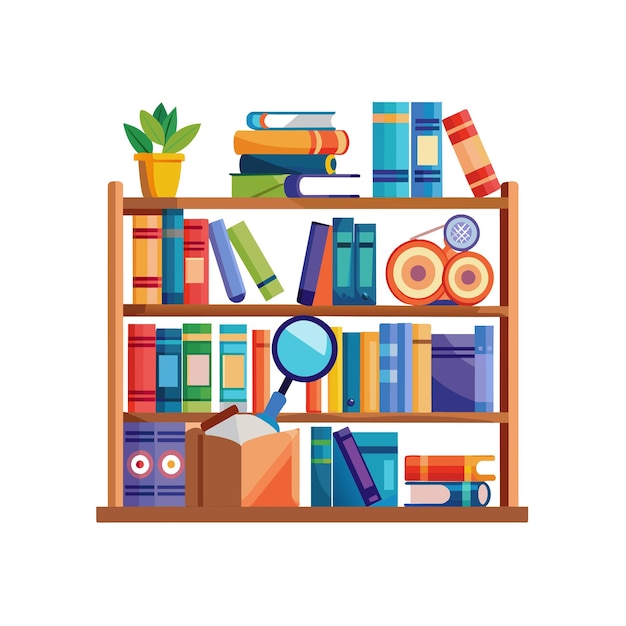
The width and height of the screenshot is (626, 626). I want to click on point where shelf connects to side of bookcase, so click(x=505, y=202), click(x=506, y=308), click(x=506, y=414), click(x=125, y=208), click(x=124, y=309), click(x=124, y=413), click(x=111, y=505), click(x=511, y=506).